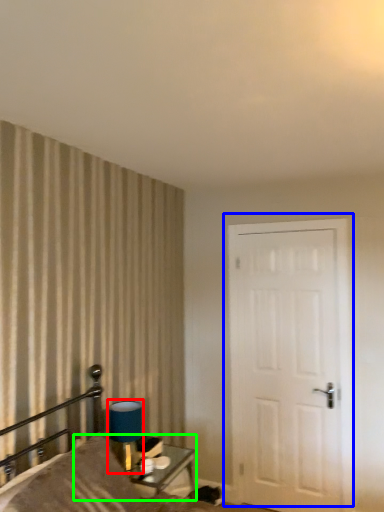
Question: Considering the real-world distances, which object is farthest from table lamp (highlighted by a red box)? door (highlighted by a blue box) or table (highlighted by a green box)?

Choices:
 (A) door
 (B) table

Answer: (A)